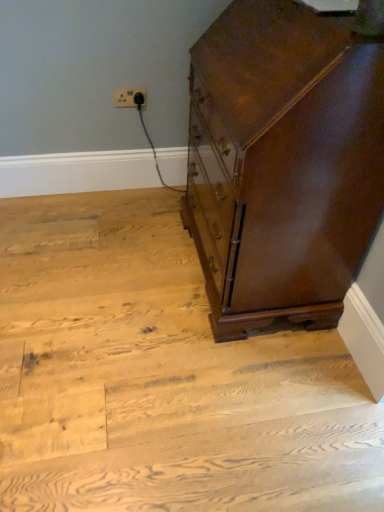
At what (x,y) coordinates should I click in order to perform the action: click on unoccupied area in front of shiny brown wood chest of drawers at right. Please return your answer as a coordinate pair (x, y). The width and height of the screenshot is (384, 512). Looking at the image, I should click on (233, 397).